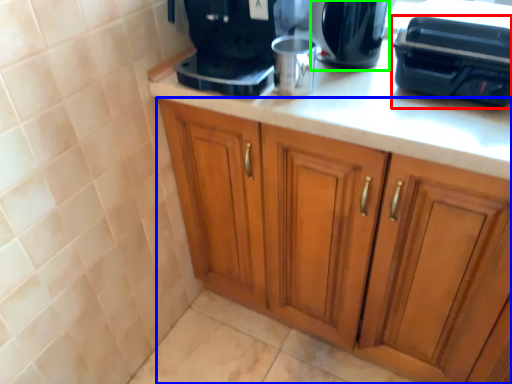
Question: Estimate the real-world distances between objects in this image. Which object is closer to appliance (highlighted by a red box), cabinetry (highlighted by a blue box) or kitchen appliance (highlighted by a green box)?

Choices:
 (A) cabinetry
 (B) kitchen appliance

Answer: (B)